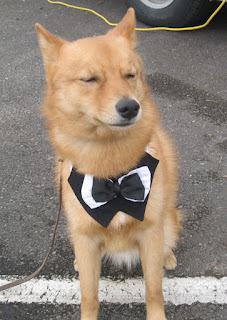
You are a GUI agent. You are given a task and a screenshot of the screen. Output one action in this format:
    pyautogui.click(x=<x>, y=<y>)
    Task: Click on the electrical cord
    The image size is (227, 320).
    Given the screenshot: What is the action you would take?
    pyautogui.click(x=189, y=27)